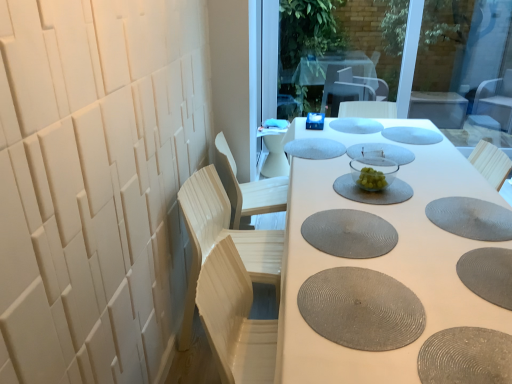
Where is `empty space that is ontop of textured gray manhole cover at lower right, which is the 10th manhole cover from back to front`? This screenshot has width=512, height=384. empty space that is ontop of textured gray manhole cover at lower right, which is the 10th manhole cover from back to front is located at coordinates (470, 354).